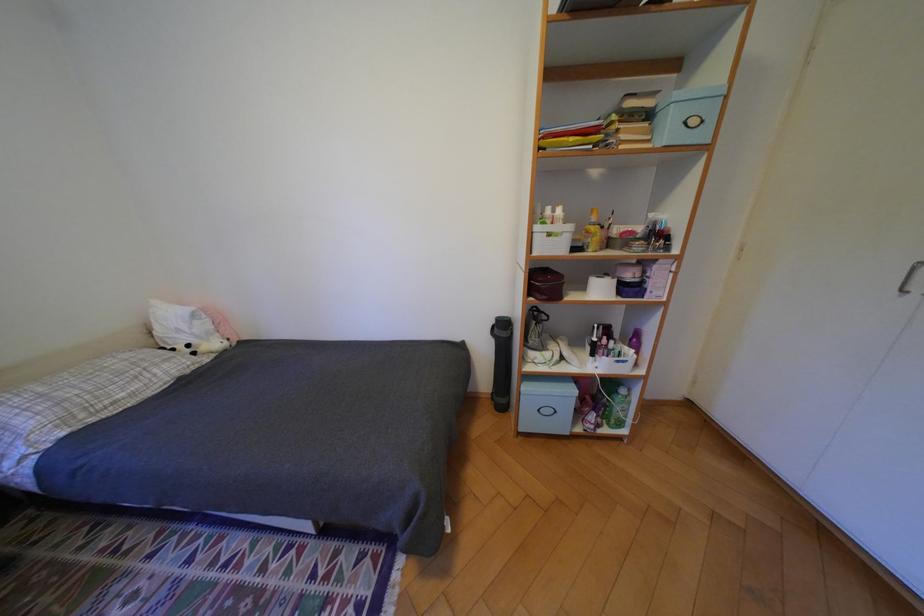
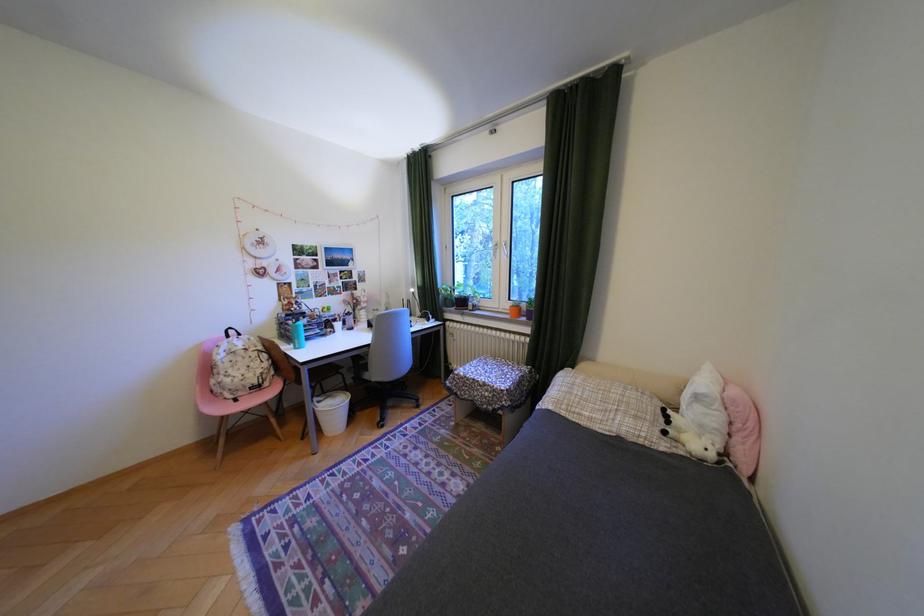
Where in the second image is the point corresponding to (209,323) from the first image?

(710, 408)